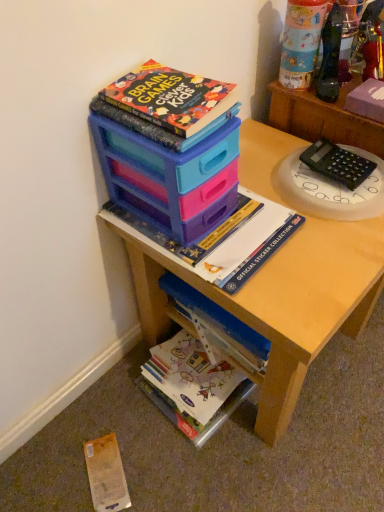
Where is `empty space that is ontop of white glossy book at lower center, which is the 1th book from bottom to top (from a real-world perspective)`? empty space that is ontop of white glossy book at lower center, which is the 1th book from bottom to top (from a real-world perspective) is located at coordinates (189, 365).